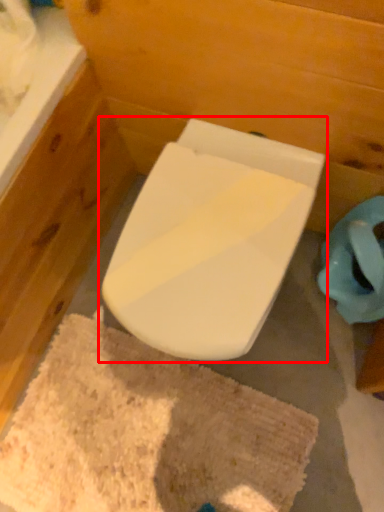
Question: Observing the image, what is the correct spatial positioning of toilet (annotated by the red box) in reference to bath mat?

Choices:
 (A) left
 (B) right

Answer: (B)